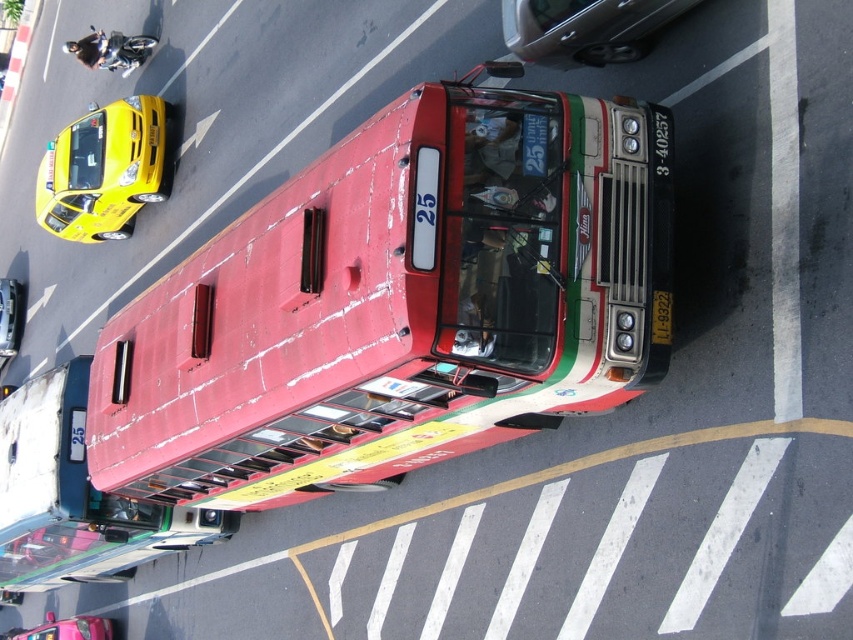
Question: Which of the following is the closest to the observer?

Choices:
 (A) metallic silver sedan at upper center
 (B) metallic pink taxi at lower left
 (C) yellow glossy taxi at upper left

Answer: (A)

Question: Is rusty metal bus at center to the right of metallic pink taxi at lower left from the viewer's perspective?

Choices:
 (A) yes
 (B) no

Answer: (A)

Question: Which point appears farthest from the camera in this image?

Choices:
 (A) (611, 29)
 (B) (12, 301)
 (C) (107, 164)
 (D) (49, 403)

Answer: (B)

Question: Considering the relative positions of yellow glossy taxi at upper left and metallic silver car at left in the image provided, where is yellow glossy taxi at upper left located with respect to metallic silver car at left?

Choices:
 (A) above
 (B) below

Answer: (A)

Question: Which point is closer to the camera taking this photo?

Choices:
 (A) (427, 428)
 (B) (91, 184)
 (C) (73, 484)

Answer: (A)

Question: Can you confirm if rusty metal bus at center is bigger than yellow glossy taxi at upper left?

Choices:
 (A) yes
 (B) no

Answer: (B)